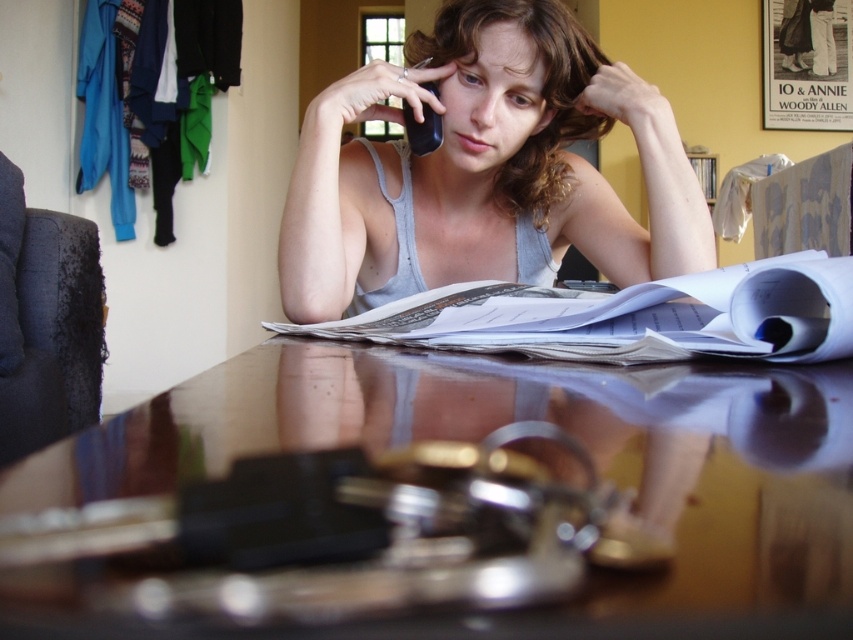
Who is positioned more to the right, glossy wooden table at center or gray cotton tank top at center?

From the viewer's perspective, glossy wooden table at center appears more on the right side.

Which is behind, point (770, 531) or point (468, 259)?

Point (468, 259)

Where is `glossy wooden table at center`? glossy wooden table at center is located at coordinates (479, 440).